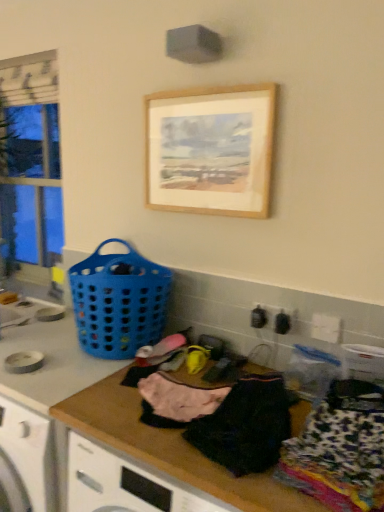
Find the location of a particular element. This screenshot has height=512, width=384. printed fabric clothing at lower right, marked as the 3th clothing in a left-to-right arrangement is located at coordinates (340, 451).

The image size is (384, 512). Describe the element at coordinates (210, 150) in the screenshot. I see `wooden picture frame at upper center` at that location.

I want to click on clear glass window at left, so coord(31,163).

Where is `wooden at center`? The height and width of the screenshot is (512, 384). wooden at center is located at coordinates (58, 375).

This screenshot has height=512, width=384. Identify the location of black cotton shirt at center, arranged as the second clothing when viewed from the left. (246, 425).

Where is `printed fabric clothing at lower right, marked as the 1th clothing in a right-to-left arrangement`? printed fabric clothing at lower right, marked as the 1th clothing in a right-to-left arrangement is located at coordinates (340, 451).

Is blue plastic basket at left spatially inside wooden picture frame at upper center, or outside of it?

blue plastic basket at left exists outside the volume of wooden picture frame at upper center.

Does blue plastic basket at left come in front of wooden picture frame at upper center?

No, blue plastic basket at left is further to the viewer.

Is blue plastic basket at left far away from wooden picture frame at upper center?

Actually, blue plastic basket at left and wooden picture frame at upper center are a little close together.

In the scene shown: Is blue plastic basket at left turned away from wooden picture frame at upper center?

blue plastic basket at left does not have its back to wooden picture frame at upper center.

How different are the orientations of blue plastic basket at left and pink fabric at center, the 1th clothing in the left-to-right sequence, in degrees?

They differ by 0.309 degrees in their facing directions.

Could you tell me if blue plastic basket at left is turned towards pink fabric at center, the 1th clothing in the left-to-right sequence?

No, blue plastic basket at left is not facing towards pink fabric at center, the 1th clothing in the left-to-right sequence.

Is point (116, 281) positioned before point (145, 404)?

That is False.

Identify the location of basket located behind the pink fabric at center, the third clothing from the right. (118, 302).

What's the angular difference between pink fabric at center, the 1th clothing in the left-to-right sequence, and clear glass window at left's facing directions?

pink fabric at center, the 1th clothing in the left-to-right sequence, and clear glass window at left are facing 0.622 degrees away from each other.

Considering the sizes of pink fabric at center, the 1th clothing in the left-to-right sequence, and clear glass window at left in the image, is pink fabric at center, the 1th clothing in the left-to-right sequence, wider or thinner than clear glass window at left?

Considering their sizes, pink fabric at center, the 1th clothing in the left-to-right sequence, looks broader than clear glass window at left.

From a real-world perspective, does pink fabric at center, the third clothing from the right, sit lower than clear glass window at left?

Yes.

Considering the relative sizes of pink fabric at center, the third clothing from the right, and clear glass window at left in the image provided, is pink fabric at center, the third clothing from the right, taller than clear glass window at left?

Incorrect, the height of pink fabric at center, the third clothing from the right, is not larger of that of clear glass window at left.

Does printed fabric clothing at lower right, marked as the 1th clothing in a right-to-left arrangement, touch wooden picture frame at upper center?

There is a gap between printed fabric clothing at lower right, marked as the 1th clothing in a right-to-left arrangement, and wooden picture frame at upper center.

From the image's perspective, which one is positioned lower, printed fabric clothing at lower right, marked as the 3th clothing in a left-to-right arrangement, or wooden picture frame at upper center?

printed fabric clothing at lower right, marked as the 3th clothing in a left-to-right arrangement, is shown below in the image.

Is the depth of printed fabric clothing at lower right, marked as the 1th clothing in a right-to-left arrangement, greater than that of wooden picture frame at upper center?

No, it is in front of wooden picture frame at upper center.

Is black cotton shirt at center, which is counted as the second clothing, starting from the right, not close to blue plastic basket at left?

No, there isn't a large distance between black cotton shirt at center, which is counted as the second clothing, starting from the right, and blue plastic basket at left.

Based on the photo, considering the positions of objects black cotton shirt at center, which is counted as the second clothing, starting from the right, and blue plastic basket at left in the image provided, who is more to the left, black cotton shirt at center, which is counted as the second clothing, starting from the right, or blue plastic basket at left?

Positioned to the left is blue plastic basket at left.

Which is behind, black cotton shirt at center, arranged as the second clothing when viewed from the left, or blue plastic basket at left?

Positioned behind is blue plastic basket at left.

Can you confirm if black cotton shirt at center, which is counted as the second clothing, starting from the right, is thinner than blue plastic basket at left?

Yes, black cotton shirt at center, which is counted as the second clothing, starting from the right, is thinner than blue plastic basket at left.

Is the depth of black cotton shirt at center, arranged as the second clothing when viewed from the left, greater than that of wooden picture frame at upper center?

No, black cotton shirt at center, arranged as the second clothing when viewed from the left, is in front of wooden picture frame at upper center.

Consider the image. How many degrees apart are the facing directions of black cotton shirt at center, which is counted as the second clothing, starting from the right, and wooden picture frame at upper center?

They differ by 0.422 degrees in their facing directions.

Can you confirm if black cotton shirt at center, which is counted as the second clothing, starting from the right, is taller than wooden picture frame at upper center?

In fact, black cotton shirt at center, which is counted as the second clothing, starting from the right, may be shorter than wooden picture frame at upper center.

Is black cotton shirt at center, arranged as the second clothing when viewed from the left, located outside wooden picture frame at upper center?

Indeed, black cotton shirt at center, arranged as the second clothing when viewed from the left, is completely outside wooden picture frame at upper center.

Where is `picture frame that appears on the right of clear glass window at left`? The width and height of the screenshot is (384, 512). picture frame that appears on the right of clear glass window at left is located at coordinates (210, 150).

Would you say clear glass window at left is to the left or to the right of wooden picture frame at upper center in the picture?

clear glass window at left is to the left of wooden picture frame at upper center.

Is clear glass window at left positioned far away from wooden picture frame at upper center?

clear glass window at left is far away from wooden picture frame at upper center.

Is clear glass window at left further to camera compared to wooden picture frame at upper center?

Yes, clear glass window at left is behind wooden picture frame at upper center.

At what (x,y) coordinates should I click in order to perform the action: click on picture frame on the right of the blue plastic basket at left. Please return your answer as a coordinate pair (x, y). This screenshot has height=512, width=384. Looking at the image, I should click on (210, 150).

I want to click on the 2nd clothing positioned below the blue plastic basket at left (from the image's perspective), so click(176, 401).

Which object lies nearer to the anchor point blue plastic basket at left, printed fabric clothing at lower right, marked as the 1th clothing in a right-to-left arrangement, or wooden at center?

Based on the image, wooden at center appears to be nearer to blue plastic basket at left.

When comparing their distances from wooden picture frame at upper center, does wooden at center or blue plastic basket at left seem further?

wooden at center is positioned further to the anchor wooden picture frame at upper center.

Considering their positions, is blue plastic basket at left positioned closer to black cotton shirt at center, arranged as the second clothing when viewed from the left, than wooden at center?

wooden at center.

From the image, which object appears to be farther from printed fabric clothing at lower right, marked as the 1th clothing in a right-to-left arrangement, black cotton shirt at center, which is counted as the second clothing, starting from the right, or wooden at center?

wooden at center lies further to printed fabric clothing at lower right, marked as the 1th clothing in a right-to-left arrangement, than the other object.

When comparing their distances from wooden picture frame at upper center, does pink fabric at center, the third clothing from the right, or wooden at center seem further?

The object further to wooden picture frame at upper center is wooden at center.

Looking at the image, which one is located further to black cotton shirt at center, arranged as the second clothing when viewed from the left, printed fabric clothing at lower right, marked as the 3th clothing in a left-to-right arrangement, or blue plastic basket at left?

The object further to black cotton shirt at center, arranged as the second clothing when viewed from the left, is blue plastic basket at left.

Considering their positions, is black cotton shirt at center, which is counted as the second clothing, starting from the right, positioned further to pink fabric at center, the 1th clothing in the left-to-right sequence, than printed fabric clothing at lower right, marked as the 1th clothing in a right-to-left arrangement?

The object further to pink fabric at center, the 1th clothing in the left-to-right sequence, is printed fabric clothing at lower right, marked as the 1th clothing in a right-to-left arrangement.

From the image, which object appears to be farther from clear glass window at left, pink fabric at center, the 1th clothing in the left-to-right sequence, or printed fabric clothing at lower right, marked as the 3th clothing in a left-to-right arrangement?

The object further to clear glass window at left is printed fabric clothing at lower right, marked as the 3th clothing in a left-to-right arrangement.

Where is `clothing located between clear glass window at left and wooden picture frame at upper center in the left-right direction`? clothing located between clear glass window at left and wooden picture frame at upper center in the left-right direction is located at coordinates (176, 401).

The width and height of the screenshot is (384, 512). I want to click on basket positioned between pink fabric at center, the third clothing from the right, and clear glass window at left from near to far, so click(118, 302).

Locate an element on the screen. The height and width of the screenshot is (512, 384). clothing positioned between black cotton shirt at center, which is counted as the second clothing, starting from the right, and blue plastic basket at left from near to far is located at coordinates (176, 401).

Locate an element on the screen. basket between wooden picture frame at upper center and printed fabric clothing at lower right, marked as the 3th clothing in a left-to-right arrangement, vertically is located at coordinates (118, 302).